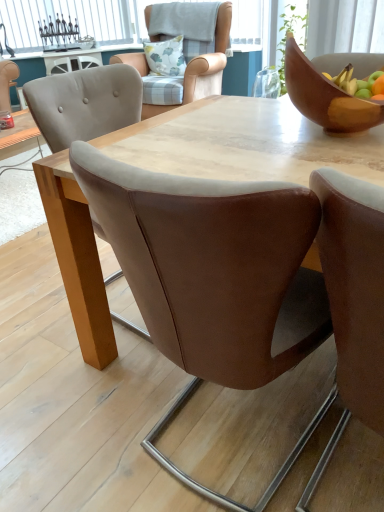
Question: Could you tell me if brown leather chair at center, arranged as the second chair when viewed from the back, is turned towards brown leather chair at center, positioned as the first chair in front-to-back order?

Choices:
 (A) no
 (B) yes

Answer: (B)

Question: Is brown leather chair at center, which is the third chair in front-to-back order, at the right side of brown leather chair at center, the 4th chair in the back-to-front sequence?

Choices:
 (A) no
 (B) yes

Answer: (A)

Question: Can brown leather chair at center, the 4th chair in the back-to-front sequence, be found inside brown leather chair at center, which is the third chair in front-to-back order?

Choices:
 (A) yes
 (B) no

Answer: (B)

Question: Is the depth of brown leather chair at center, which is the third chair in front-to-back order, less than that of brown leather chair at center, the 4th chair in the back-to-front sequence?

Choices:
 (A) yes
 (B) no

Answer: (B)

Question: From the image's perspective, is brown leather chair at center, which is the third chair in front-to-back order, located above brown leather chair at center, the 4th chair in the back-to-front sequence?

Choices:
 (A) no
 (B) yes

Answer: (B)

Question: From the image's perspective, would you say brown leather chair at center, arranged as the second chair when viewed from the back, is shown under brown leather chair at center, positioned as the first chair in front-to-back order?

Choices:
 (A) no
 (B) yes

Answer: (A)

Question: Is brown leather chair at center, which is the third chair in front-to-back order, positioned with its back to wooden bowl at upper right?

Choices:
 (A) yes
 (B) no

Answer: (B)

Question: From a real-world perspective, is brown leather chair at center, which is the third chair in front-to-back order, physically below wooden bowl at upper right?

Choices:
 (A) yes
 (B) no

Answer: (A)

Question: Considering the relative sizes of brown leather chair at center, arranged as the second chair when viewed from the back, and wooden bowl at upper right in the image provided, is brown leather chair at center, arranged as the second chair when viewed from the back, taller than wooden bowl at upper right?

Choices:
 (A) no
 (B) yes

Answer: (B)

Question: From the image's perspective, is brown leather chair at center, arranged as the second chair when viewed from the back, located beneath wooden bowl at upper right?

Choices:
 (A) no
 (B) yes

Answer: (B)

Question: Considering the relative sizes of brown leather chair at center, which is the third chair in front-to-back order, and wooden bowl at upper right in the image provided, is brown leather chair at center, which is the third chair in front-to-back order, bigger than wooden bowl at upper right?

Choices:
 (A) no
 (B) yes

Answer: (B)

Question: Is wooden bowl at upper right a part of brown leather chair at center, which is the third chair in front-to-back order?

Choices:
 (A) yes
 (B) no

Answer: (B)

Question: From a real-world perspective, is brown leather chair at center, the 4th chair in the back-to-front sequence, located higher than white glass window at upper left?

Choices:
 (A) yes
 (B) no

Answer: (B)